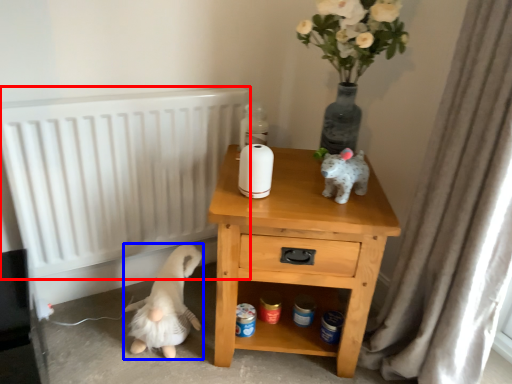
Question: Which of the following is the farthest to the observer, radiator (highlighted by a red box) or animal (highlighted by a blue box)?

Choices:
 (A) radiator
 (B) animal

Answer: (B)